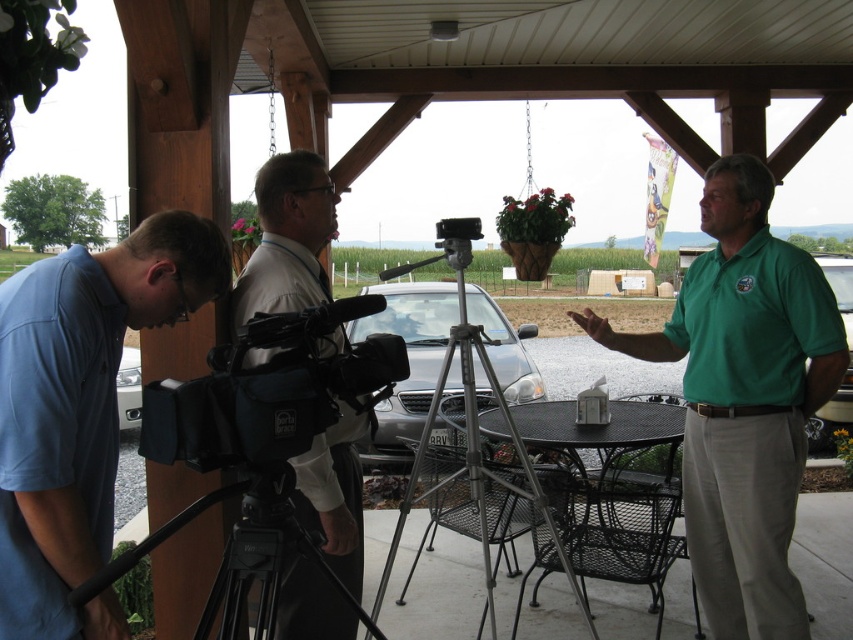
Can you confirm if black fabric video camera at center is thinner than black matte tripod at lower left?

Indeed, black fabric video camera at center has a lesser width compared to black matte tripod at lower left.

Is point (190, 448) positioned in front of point (229, 561)?

Yes, point (190, 448) is in front of point (229, 561).

Locate an element on the screen. The image size is (853, 640). black fabric video camera at center is located at coordinates (x=270, y=392).

Can you confirm if blue cotton shirt at lower left is positioned above white shirt at center?

Yes, blue cotton shirt at lower left is above white shirt at center.

Is blue cotton shirt at lower left below white shirt at center?

Incorrect, blue cotton shirt at lower left is not positioned below white shirt at center.

The height and width of the screenshot is (640, 853). What do you see at coordinates (80, 410) in the screenshot?
I see `blue cotton shirt at lower left` at bounding box center [80, 410].

You are a GUI agent. You are given a task and a screenshot of the screen. Output one action in this format:
    pyautogui.click(x=<x>, y=<y>)
    Task: Click on the blue cotton shirt at lower left
    This screenshot has width=853, height=640.
    Given the screenshot: What is the action you would take?
    pyautogui.click(x=80, y=410)

Looking at this image, does black fabric video camera at center appear on the left side of metallic tripod at center?

Indeed, black fabric video camera at center is positioned on the left side of metallic tripod at center.

Does black fabric video camera at center have a lesser height compared to metallic tripod at center?

Correct, black fabric video camera at center is not as tall as metallic tripod at center.

Who is more distant from viewer, [244,420] or [460,352]?

The point [460,352] is behind.

Where is `black fabric video camera at center`? black fabric video camera at center is located at coordinates (270, 392).